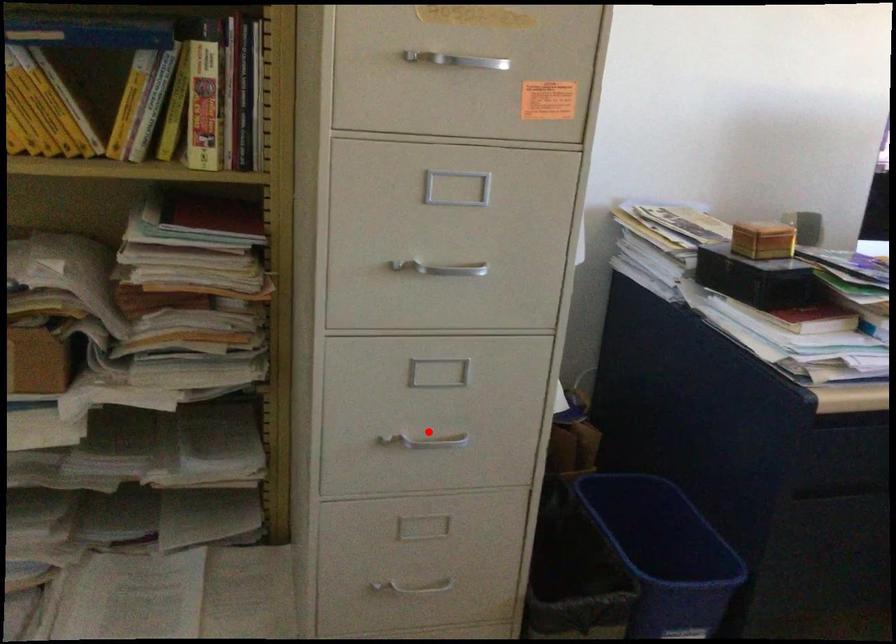
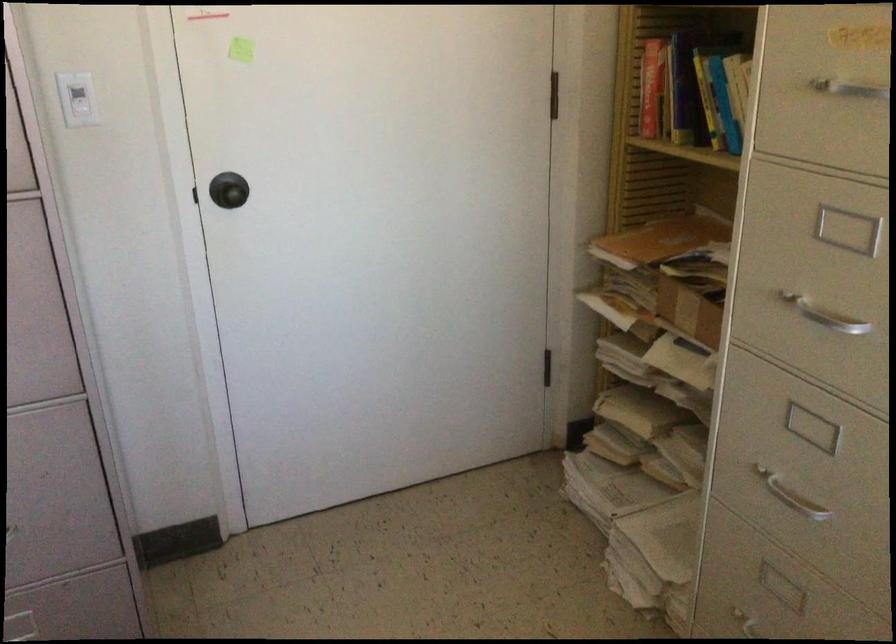
In the second image, find the point that corresponds to the highlighted location in the first image.

(790, 496)